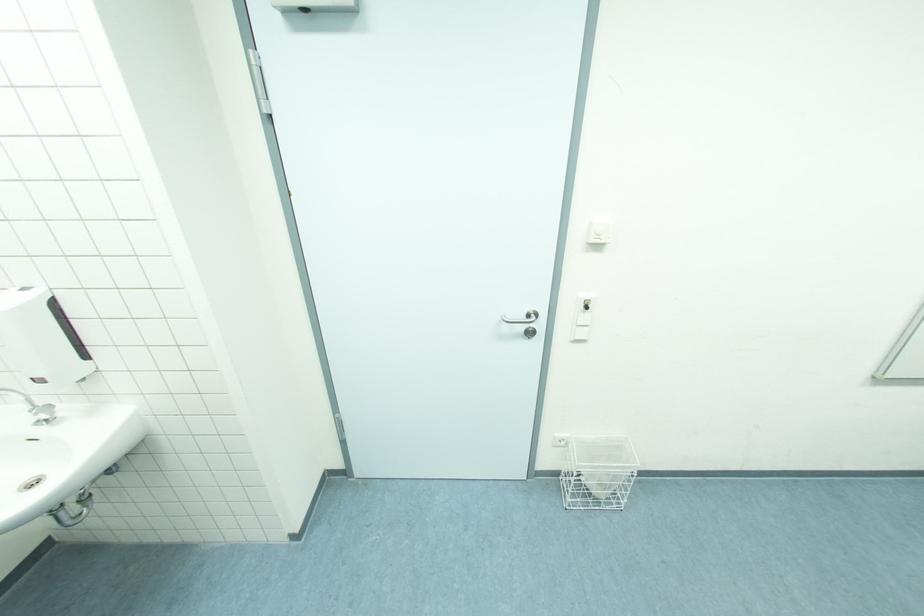
The width and height of the screenshot is (924, 616). What do you see at coordinates (598, 472) in the screenshot? I see `a white wire basket` at bounding box center [598, 472].